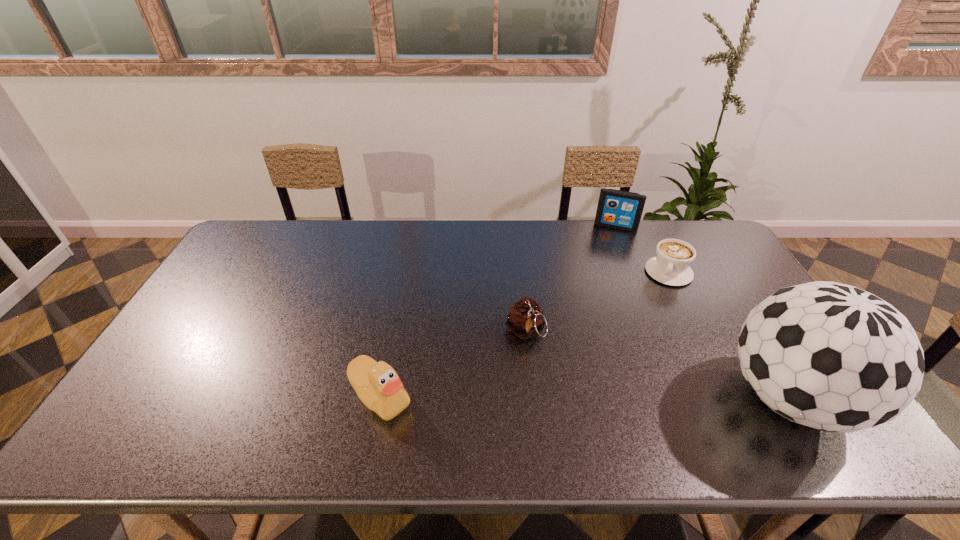
Locate an element on the screen. The image size is (960, 540). vacant space on the desktop that is between the leftmost object and the soccer ball and is positioned with a leaf charm attached to the fourth object from right to left is located at coordinates (544, 397).

At what (x,y) coordinates should I click in order to perform the action: click on vacant space on the desktop that is between the duck and the tallest object and is positioned to the right of the cappuccino's handle. Please return your answer as a coordinate pair (x, y). Looking at the image, I should click on (633, 397).

Locate an element on the screen. The height and width of the screenshot is (540, 960). vacant space on the desktop that is between the leftmost object and the soccer ball and is positioned on the front screen of the iPod is located at coordinates 576,397.